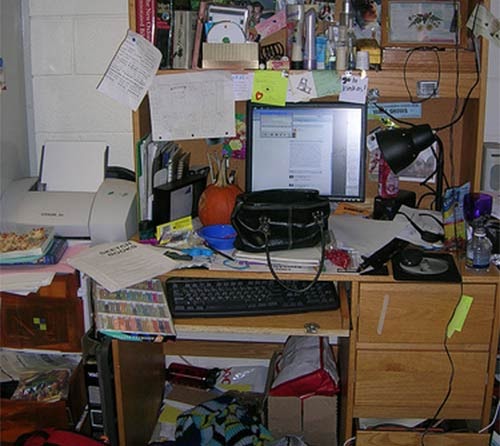
In order to click on keyboard in this screenshot , I will do `click(244, 305)`.